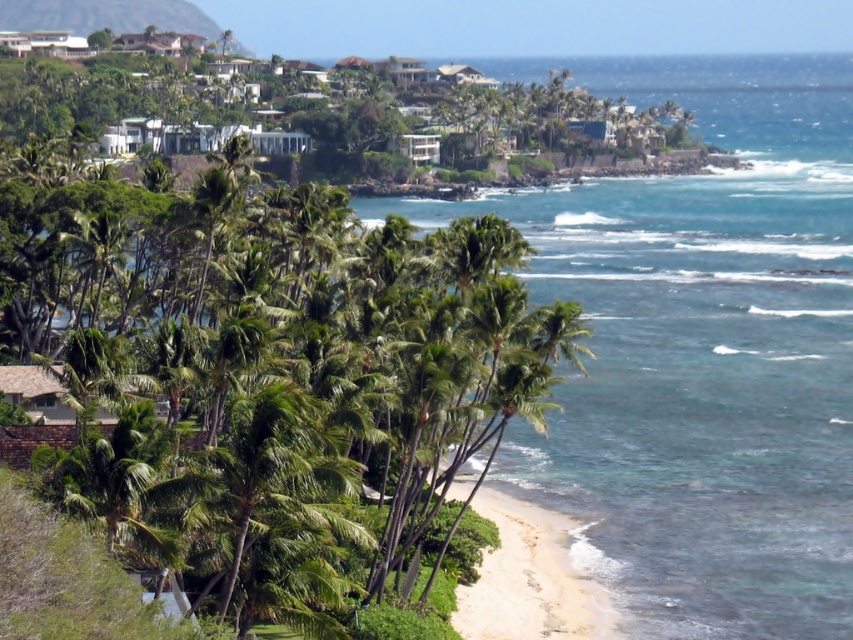
Question: Can you confirm if green leafy palm tree at center is positioned to the left of clear blue water at center?

Choices:
 (A) no
 (B) yes

Answer: (B)

Question: Does green leafy palm tree at center lie behind clear blue water at center?

Choices:
 (A) yes
 (B) no

Answer: (B)

Question: Which point is farther to the camera?

Choices:
 (A) (206, 572)
 (B) (431, 209)
 (C) (496, 618)

Answer: (B)

Question: Which of the following is the farthest from the observer?

Choices:
 (A) clear blue water at center
 (B) white sand beach at lower center

Answer: (A)

Question: Is green leafy palm tree at center above clear blue water at center?

Choices:
 (A) no
 (B) yes

Answer: (A)

Question: Among these objects, which one is nearest to the camera?

Choices:
 (A) white sand beach at lower center
 (B) green leafy palm tree at center
 (C) clear blue water at center

Answer: (B)